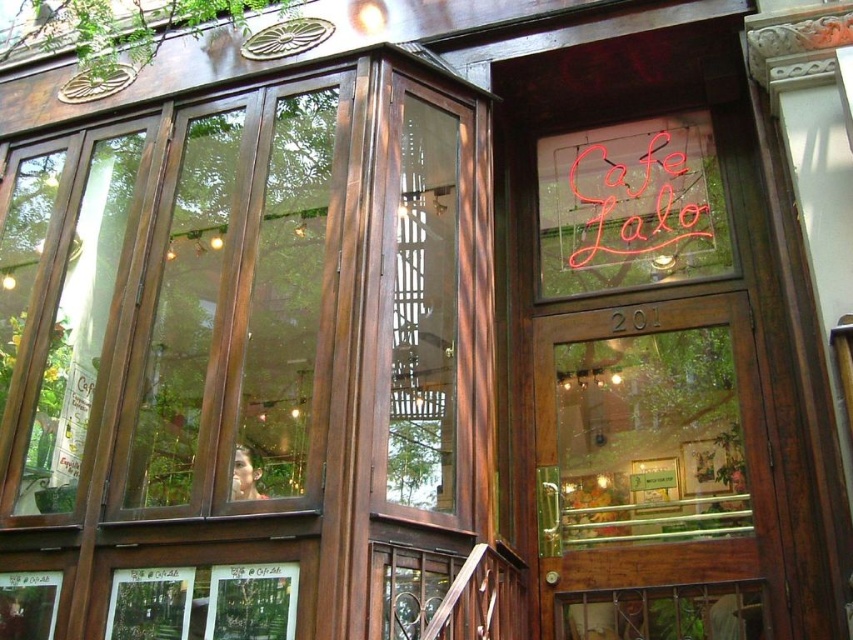
You are a delivery person trying to enter the Cafe Lalo. You see the wooden door at center and the neon sign at upper right. Which object is bigger in size?

The wooden door at center is larger in size than the neon sign at upper right.

What are the coordinates of the neon sign at upper right in the image?

The neon sign at upper right is located at point (637, 200).

You are a delivery person trying to locate the entrance to Cafe Lalo. You see the neon sign at upper right and the wooden sign at center. Which sign is closer to the entrance?

The wooden sign at center is closer to the entrance because the neon sign at upper right is 27.60 inches away from it, so the wooden sign is nearer to the entrance than the neon sign.